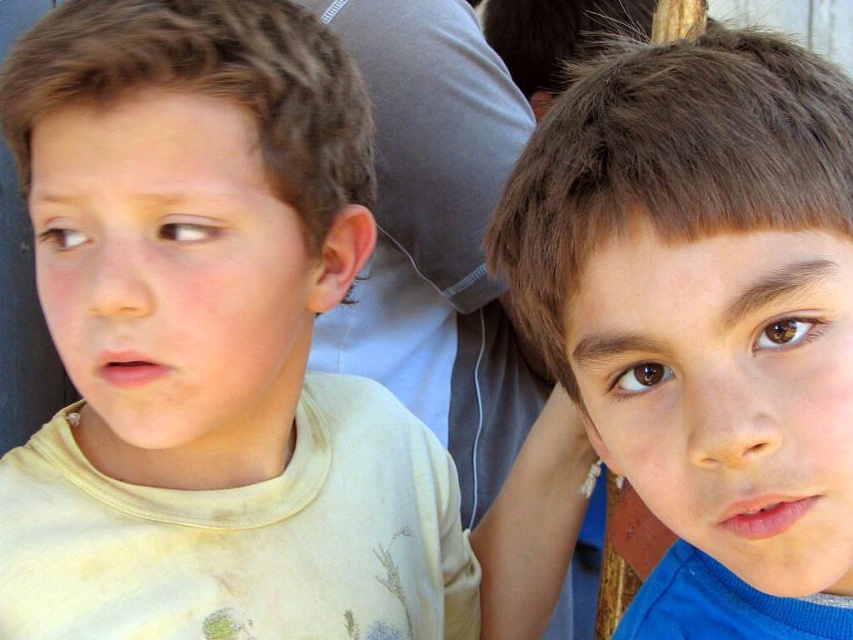
You are a photographer trying to focus on the boy on the right. There is a point at coordinates (703, 292). Is this point located on the brown hair of the boy on the right?

Yes, the point (703, 292) is on the brown hair at upper right of the boy on the right.

You are a photographer trying to capture a group photo of the two boys. The camera you are using has a focus setting that prioritizes objects based on their size. Which object should the camera focus on first between the brown hair at upper right and the yellow cotton shirt at left?

The camera should focus on the yellow cotton shirt at left first because the brown hair at upper right has a smaller size compared to yellow cotton shirt at left, making the shirt larger and thus prioritized by the camera.